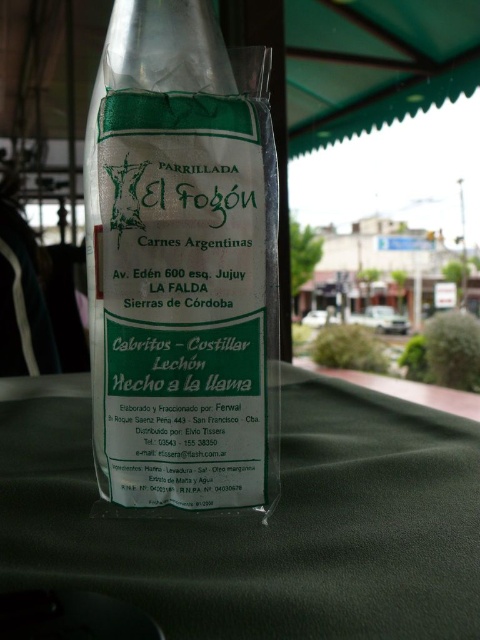
Does transparent plastic bag at center have a larger size compared to green fabric table at center?

Actually, transparent plastic bag at center might be smaller than green fabric table at center.

Between point (95, 140) and point (250, 625), which one is positioned in front?

Point (250, 625) is in front.

This screenshot has height=640, width=480. What are the coordinates of `transparent plastic bag at center` in the screenshot? It's located at (180, 268).